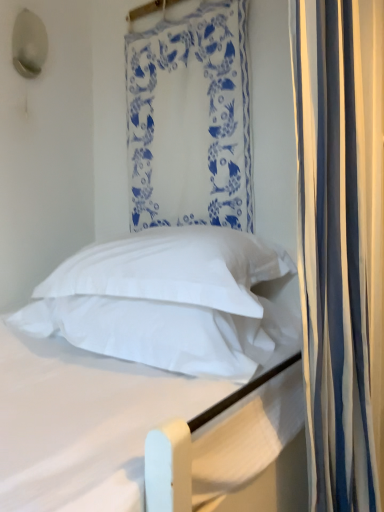
Question: From the image's perspective, is white striped curtain at right, marked as the second curtain in a left-to-right arrangement, positioned above or below white soft pillow at center, which is the second pillow in top-to-bottom order?

Choices:
 (A) below
 (B) above

Answer: (B)

Question: From a real-world perspective, is white striped curtain at right, which is counted as the 2th curtain, starting from the back, physically located above or below white soft pillow at center, which appears as the 1th pillow when ordered from the bottom?

Choices:
 (A) above
 (B) below

Answer: (A)

Question: Estimate the real-world distances between objects in this image. Which object is closer to the white soft bed at center?

Choices:
 (A) white soft pillow at center, which appears as the 1th pillow when ordered from the bottom
 (B) white fabric at upper center, placed as the 1th curtain when sorted from back to front
 (C) white striped curtain at right, placed as the first curtain when sorted from front to back
 (D) white soft pillow at center, the 1th pillow in the top-to-bottom sequence

Answer: (A)

Question: Estimate the real-world distances between objects in this image. Which object is farther from the white soft pillow at center, which is counted as the second pillow, starting from the bottom?

Choices:
 (A) white soft pillow at center, which is the second pillow in top-to-bottom order
 (B) white striped curtain at right, which is the first curtain in right-to-left order
 (C) white soft bed at center
 (D) white fabric at upper center, placed as the 1th curtain when sorted from back to front

Answer: (D)